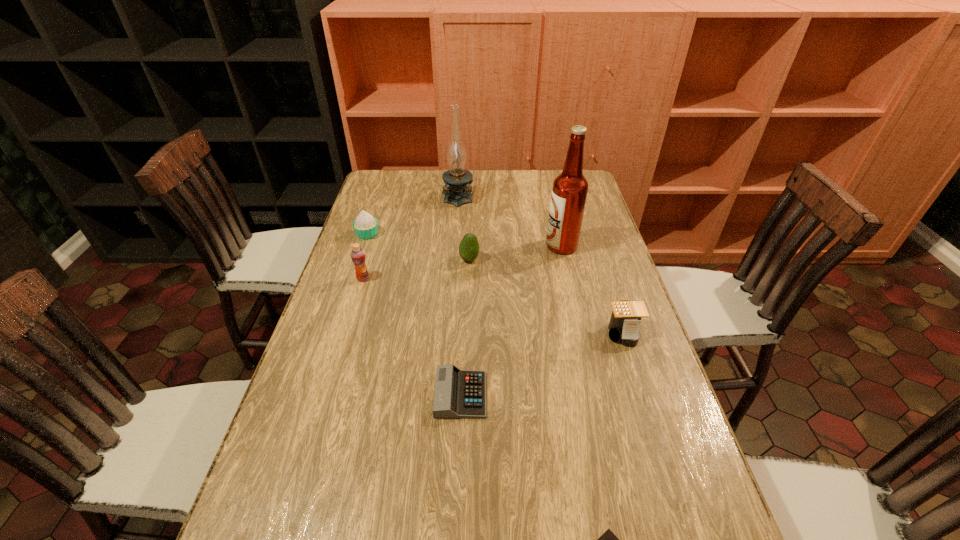
Image resolution: width=960 pixels, height=540 pixels. What are the coordinates of `orange juice that is at the left edge` in the screenshot? It's located at (358, 257).

Locate an element on the screen. Image resolution: width=960 pixels, height=540 pixels. cupcake that is at the left edge is located at coordinates (365, 225).

This screenshot has width=960, height=540. In order to click on alcohol at the right edge in this screenshot , I will do `click(569, 192)`.

Where is `calculator situated at the right edge`? Image resolution: width=960 pixels, height=540 pixels. calculator situated at the right edge is located at coordinates (624, 324).

Identify the location of vacant space at the far edge. (421, 198).

The image size is (960, 540). In the image, there is a desktop. Find the location of `vacant space at the left edge`. vacant space at the left edge is located at coordinates (338, 329).

The image size is (960, 540). I want to click on free space at the right edge of the desktop, so click(x=593, y=338).

In the image, there is a desktop. In order to click on vacant region at the far left corner in this screenshot , I will do `click(401, 191)`.

You are a GUI agent. You are given a task and a screenshot of the screen. Output one action in this format:
    pyautogui.click(x=<x>, y=<y>)
    Task: Click on the vacant area between the third tallest object and the avocado
    This screenshot has height=540, width=960.
    Given the screenshot: What is the action you would take?
    pyautogui.click(x=417, y=269)

At what (x,y) coordinates should I click in order to perform the action: click on vacant area that lies between the avocado and the fifth farthest object. Please return your answer as a coordinate pair (x, y). This screenshot has height=540, width=960. Looking at the image, I should click on (417, 269).